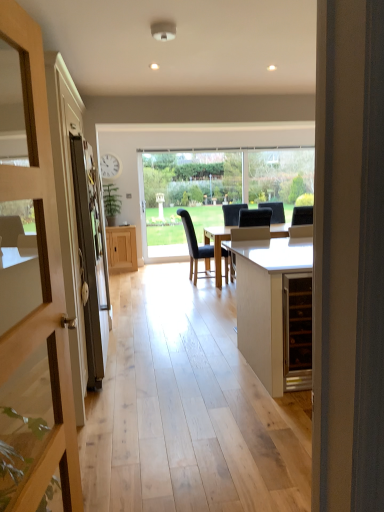
Question: Considering the relative positions of matte black screen door at left and transparent glass window at center in the image provided, is matte black screen door at left to the left or to the right of transparent glass window at center?

Choices:
 (A) left
 (B) right

Answer: (A)

Question: In terms of height, does matte black screen door at left look taller or shorter compared to transparent glass window at center?

Choices:
 (A) tall
 (B) short

Answer: (B)

Question: Which of these objects is positioned farthest from the black leather swivel chair at center?

Choices:
 (A) wooden door at left
 (B) matte black screen door at left
 (C) white wood wine cabinet at center, positioned as the 1th cabinetry in right-to-left order
 (D) wooden cabinet at center, the 2th cabinetry positioned from the front
 (E) transparent glass window at center

Answer: (A)

Question: Which is nearer to the matte black screen door at left?

Choices:
 (A) black fabric chair at center
 (B) white wood wine cabinet at center, the second cabinetry in the back-to-front sequence
 (C) wooden door at left
 (D) transparent glass window at center
 (E) wooden cabinet at center, the first cabinetry viewed from the back

Answer: (C)